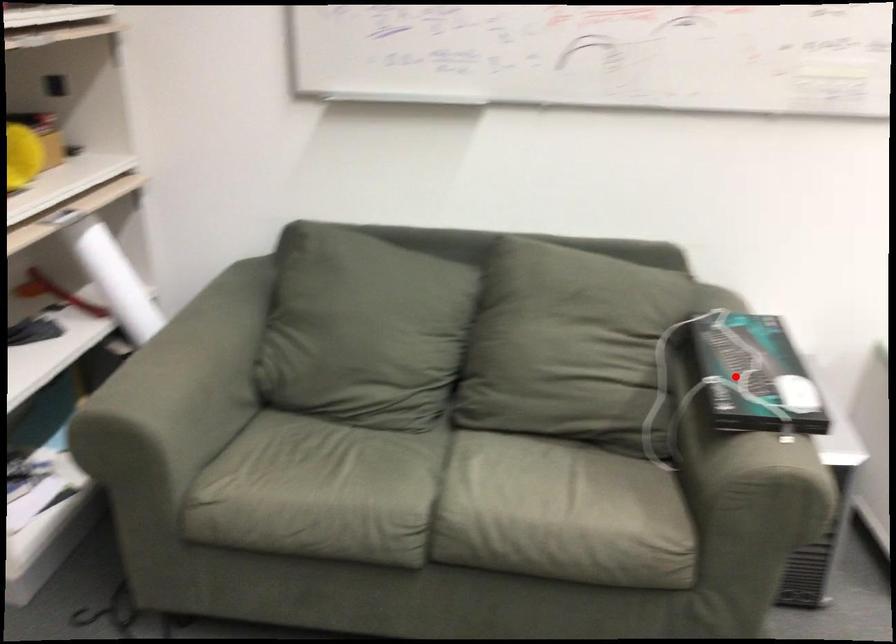
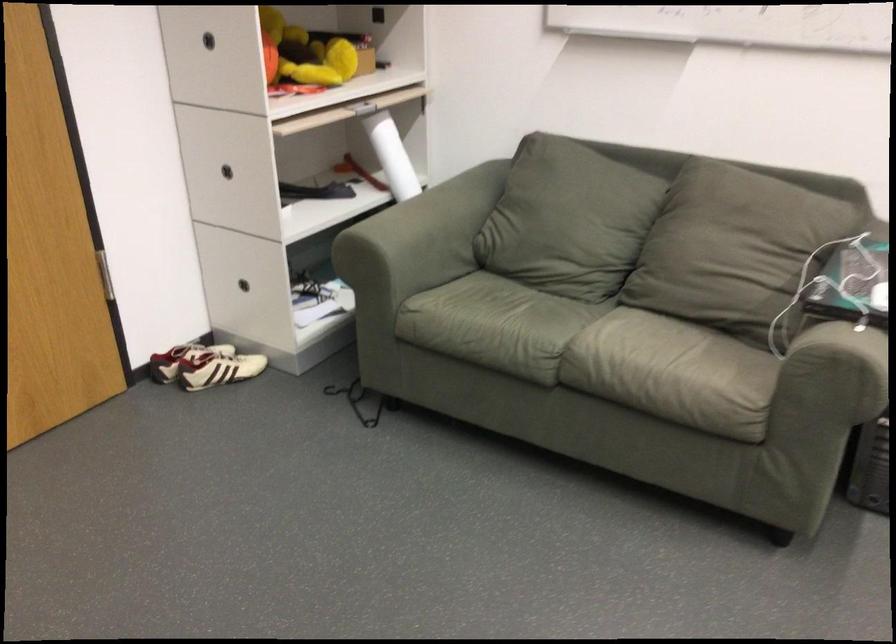
Where in the second image is the point corresponding to the highlighted location from the first image?

(851, 279)